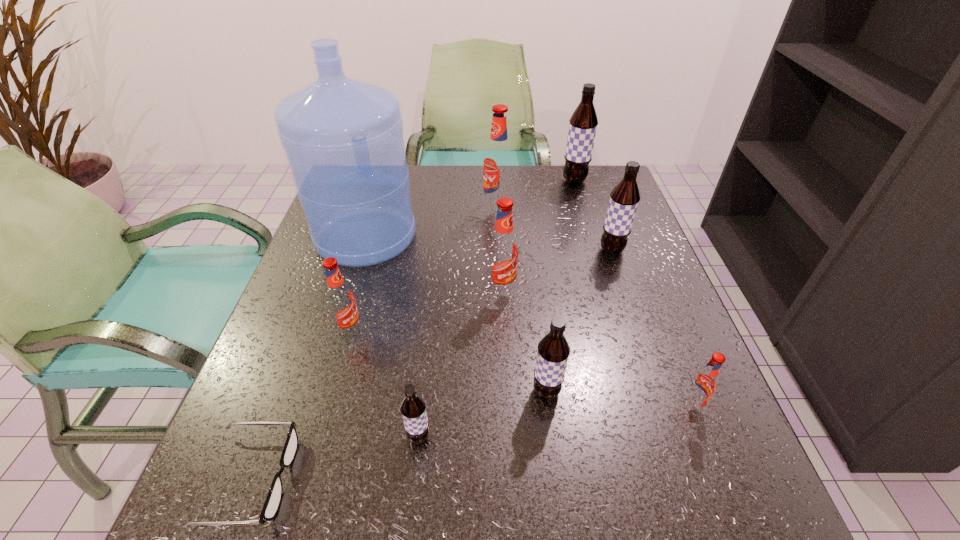
Find the location of a particular element. The image size is (960, 540). root beer identified as the fourth closest to the second nearest red root beer is located at coordinates (498, 159).

Find the location of a particular element. This screenshot has height=540, width=960. brown root beer that stands as the closest to the biggest brown root beer is located at coordinates (624, 198).

Identify which brown root beer is located as the second nearest to the black spectacles. Please provide its 2D coordinates. Your answer should be formatted as a tuple, i.e. [(x, y)], where the tuple contains the x and y coordinates of a point satisfying the conditions above.

[(553, 350)]

Locate which red root beer ranks second in proximity to the shortest object. Please provide its 2D coordinates. Your answer should be formatted as a tuple, i.e. [(x, y)], where the tuple contains the x and y coordinates of a point satisfying the conditions above.

[(502, 254)]

You are a GUI agent. You are given a task and a screenshot of the screen. Output one action in this format:
    pyautogui.click(x=<x>, y=<y>)
    Task: Click on the red root beer that stands as the third closest to the smallest red root beer
    This screenshot has height=540, width=960.
    Given the screenshot: What is the action you would take?
    pyautogui.click(x=498, y=159)

At what (x,y) coordinates should I click in order to perform the action: click on vacant space that satisfies the following two spatial constraints: 1. on the back side of the fourth farthest root beer; 2. on the right side of the biggest brown root beer. Please return your answer as a coordinate pair (x, y). Looking at the image, I should click on (495, 181).